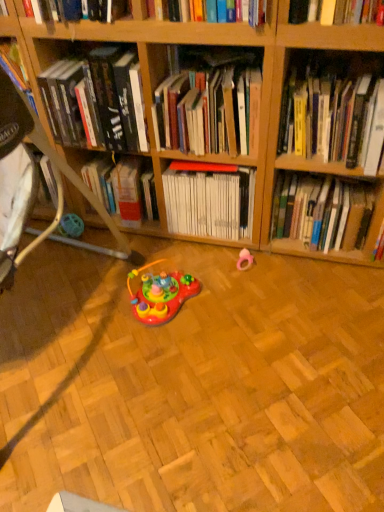
You are a GUI agent. You are given a task and a screenshot of the screen. Output one action in this format:
    pyautogui.click(x=<x>, y=<y>)
    Task: Click on the vacant area that is in front of shiny plastic toy at center, placed as the 2th toy when sorted from right to left
    
    Given the screenshot: What is the action you would take?
    pyautogui.click(x=167, y=362)